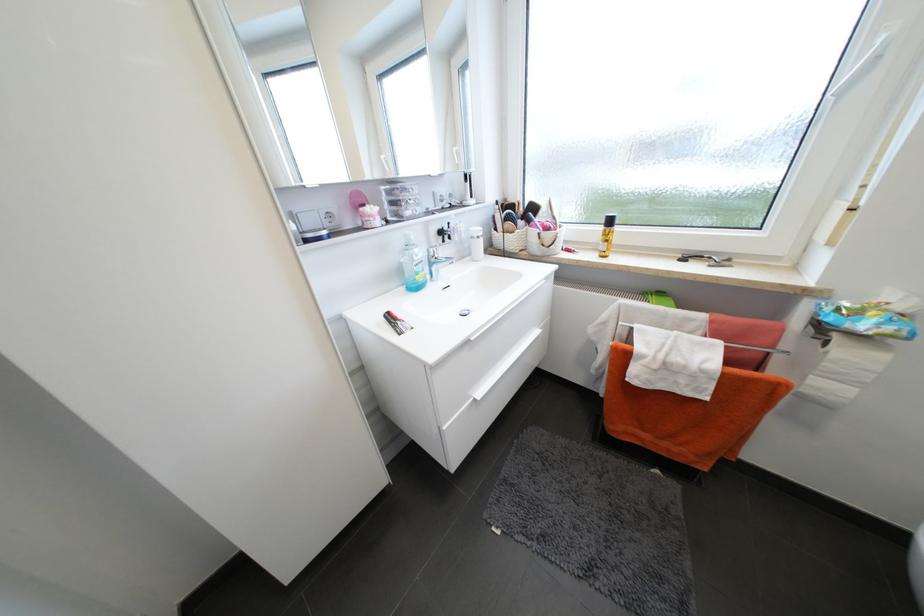
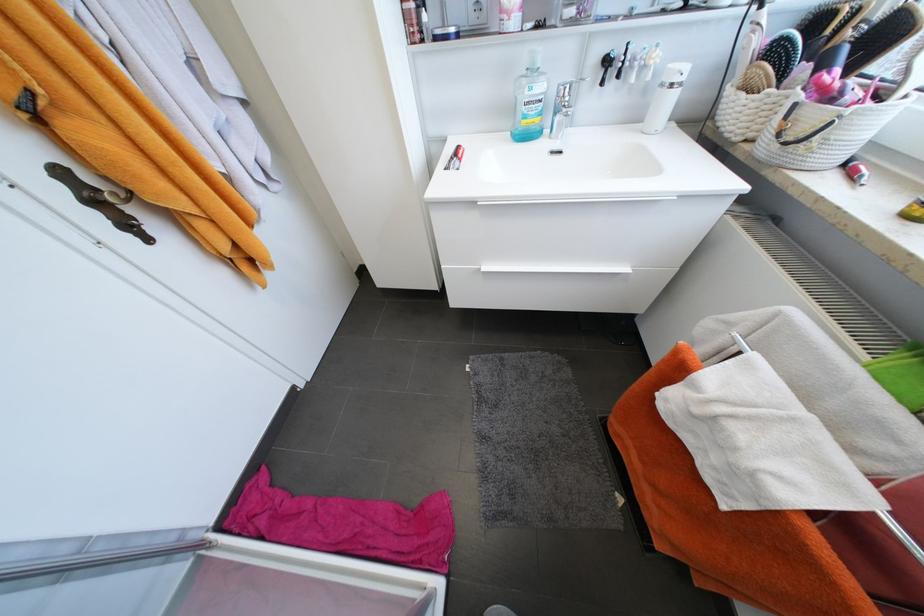
In the second image, find the point that corresponds to pixel 423 278 in the first image.

(529, 123)